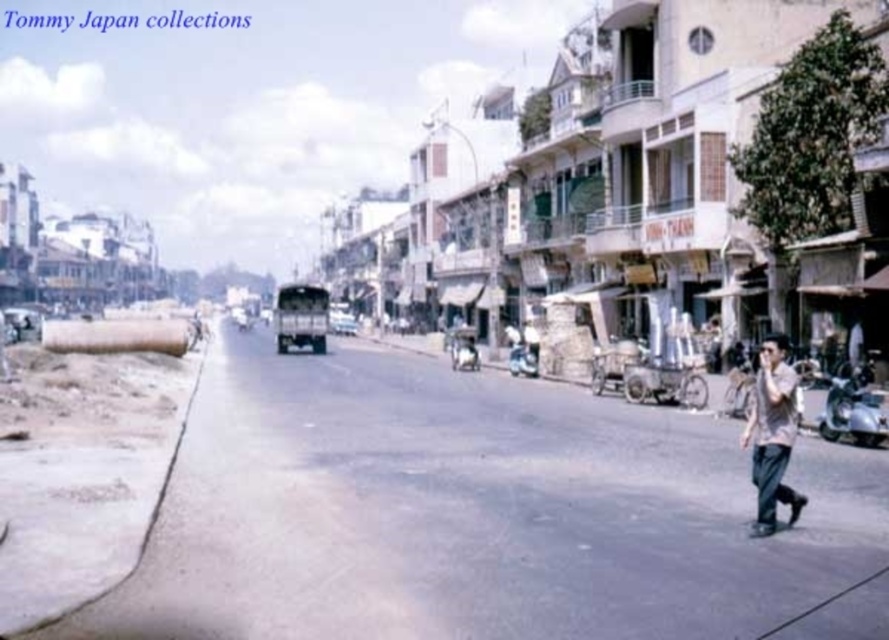
Question: Can you confirm if light brown cotton shirt at lower right is positioned below metallic silver bus at center?

Choices:
 (A) no
 (B) yes

Answer: (B)

Question: Is light brown cotton shirt at lower right wider than metallic silver bus at center?

Choices:
 (A) no
 (B) yes

Answer: (B)

Question: Which of the following is the farthest from the observer?

Choices:
 (A) (335, 330)
 (B) (767, 369)

Answer: (A)

Question: Does light brown cotton shirt at lower right have a smaller size compared to metallic silver bus at center?

Choices:
 (A) no
 (B) yes

Answer: (A)